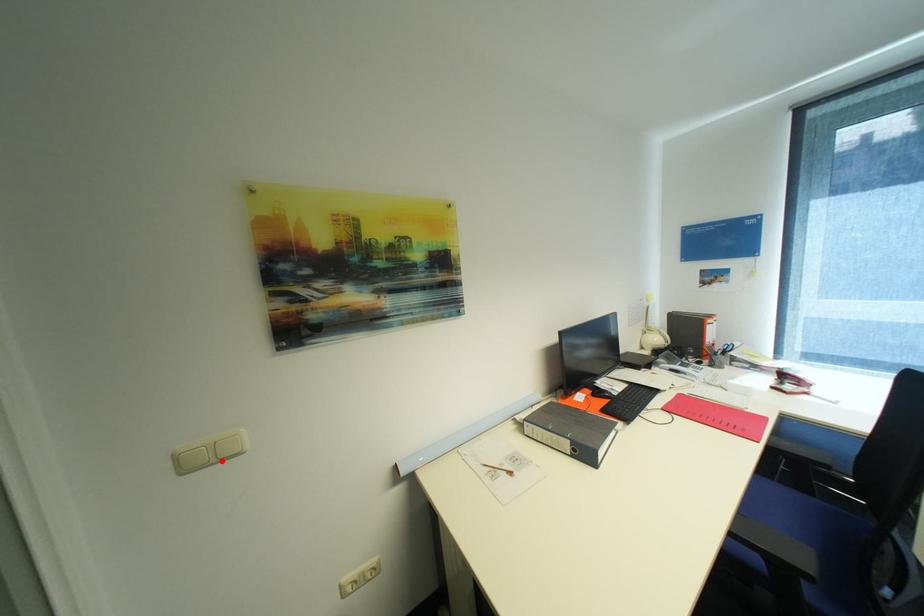
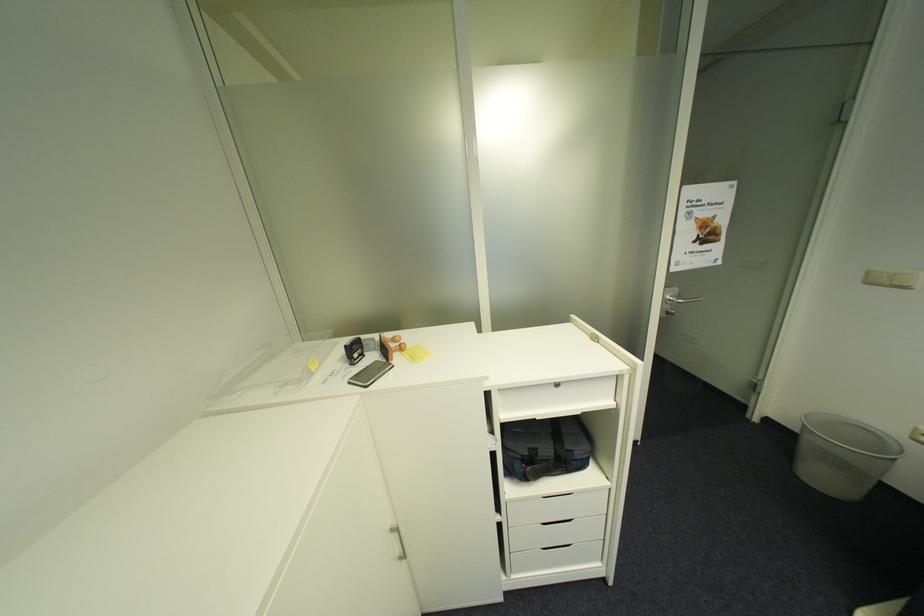
Find the pixel in the second image that matches the highlighted location in the first image.

(895, 285)